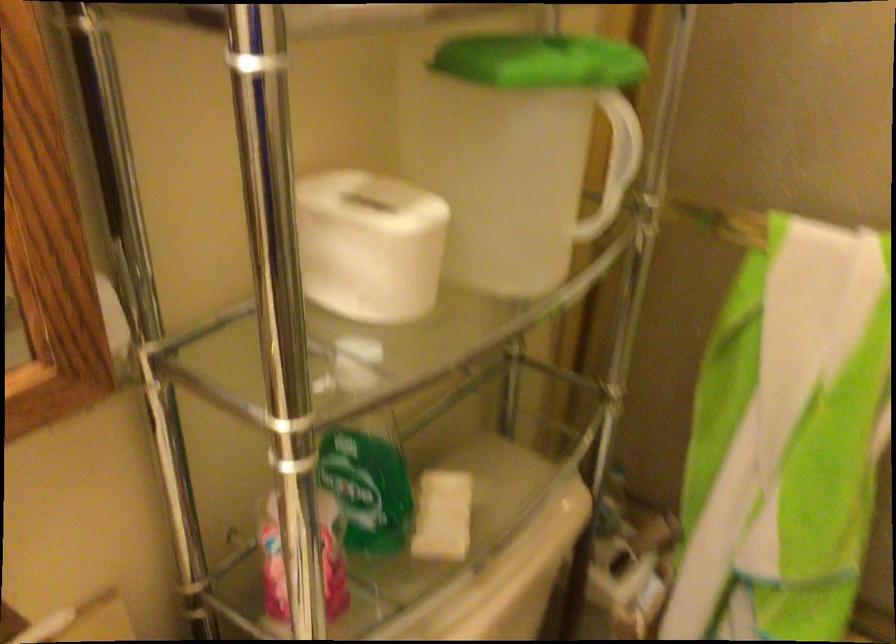
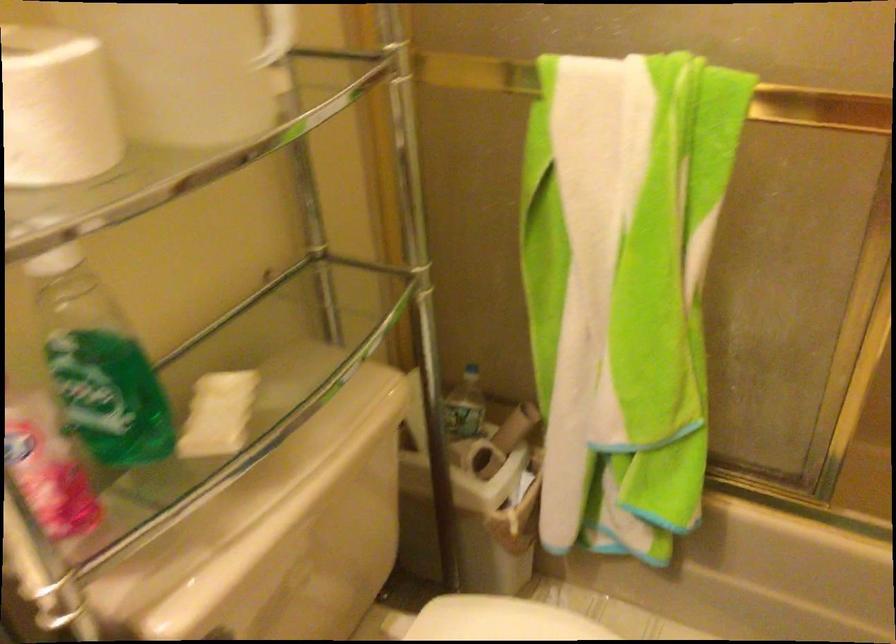
Where in the second image is the point corresponding to (x=371, y=466) from the first image?

(98, 365)